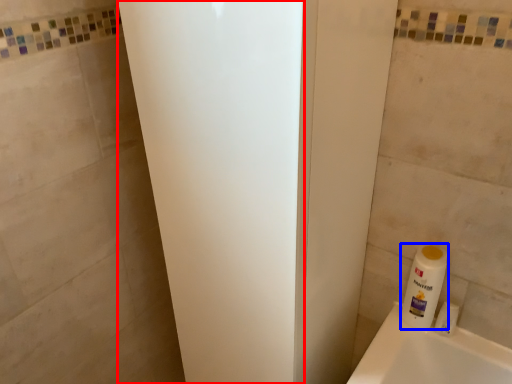
Question: Which point is further to the camera, screen door (highlighted by a red box) or cleaning product (highlighted by a blue box)?

Choices:
 (A) screen door
 (B) cleaning product

Answer: (B)